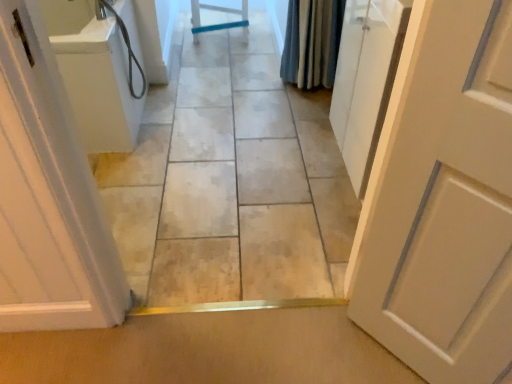
Question: Is smooth tile floor at center to the left of white glossy door at left, which ranks as the first door in left-to-right order, from the viewer's perspective?

Choices:
 (A) no
 (B) yes

Answer: (A)

Question: Is smooth tile floor at center facing away from white glossy door at left, which ranks as the first door in left-to-right order?

Choices:
 (A) no
 (B) yes

Answer: (A)

Question: Would you consider smooth tile floor at center to be distant from white glossy door at left, which ranks as the first door in left-to-right order?

Choices:
 (A) no
 (B) yes

Answer: (A)

Question: From a real-world perspective, is smooth tile floor at center physically below white glossy door at left, which ranks as the first door in left-to-right order?

Choices:
 (A) no
 (B) yes

Answer: (B)

Question: Considering the relative sizes of smooth tile floor at center and white glossy door at left, which is counted as the second door, starting from the right, in the image provided, is smooth tile floor at center taller than white glossy door at left, which is counted as the second door, starting from the right,?

Choices:
 (A) no
 (B) yes

Answer: (A)

Question: Is smooth tile floor at center positioned beyond the bounds of white glossy door at left, which ranks as the first door in left-to-right order?

Choices:
 (A) no
 (B) yes

Answer: (B)

Question: Does blue textured fabric shower curtain at upper right turn towards white glossy door at left, which ranks as the first door in left-to-right order?

Choices:
 (A) no
 (B) yes

Answer: (A)

Question: From the image's perspective, is blue textured fabric shower curtain at upper right below white glossy door at left, which is counted as the second door, starting from the right?

Choices:
 (A) no
 (B) yes

Answer: (A)

Question: Is blue textured fabric shower curtain at upper right placed right next to white glossy door at left, which ranks as the first door in left-to-right order?

Choices:
 (A) no
 (B) yes

Answer: (A)

Question: Is blue textured fabric shower curtain at upper right positioned before white glossy door at left, which is counted as the second door, starting from the right?

Choices:
 (A) no
 (B) yes

Answer: (A)

Question: Considering the relative sizes of blue textured fabric shower curtain at upper right and white glossy door at left, which ranks as the first door in left-to-right order, in the image provided, is blue textured fabric shower curtain at upper right thinner than white glossy door at left, which ranks as the first door in left-to-right order,?

Choices:
 (A) no
 (B) yes

Answer: (B)

Question: Is blue textured fabric shower curtain at upper right outside of white glossy door at left, which ranks as the first door in left-to-right order?

Choices:
 (A) yes
 (B) no

Answer: (A)

Question: Is white glossy door at left, which is counted as the second door, starting from the right, further to the viewer compared to smooth tile floor at center?

Choices:
 (A) yes
 (B) no

Answer: (B)